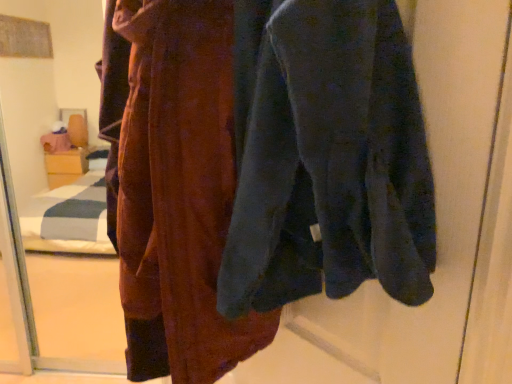
At what (x,y) coordinates should I click in order to perform the action: click on velvet dark blue sweatshirt at center. Please return your answer as a coordinate pair (x, y). Looking at the image, I should click on (326, 157).

Measure the distance between point (415,290) and camera.

Point (415,290) is 19.02 inches from camera.

What do you see at coordinates (326, 157) in the screenshot? I see `velvet dark blue sweatshirt at center` at bounding box center [326, 157].

Identify the location of velvet maroon robe at center. The height and width of the screenshot is (384, 512). (173, 185).

Describe the element at coordinates (173, 185) in the screenshot. I see `velvet maroon robe at center` at that location.

Identify the location of velvet dark blue sweatshirt at center. Image resolution: width=512 pixels, height=384 pixels. (326, 157).

Can you confirm if velvet dark blue sweatshirt at center is positioned to the right of velvet maroon robe at center?

Yes.

In the scene shown: Does velvet dark blue sweatshirt at center lie behind velvet maroon robe at center?

No, velvet dark blue sweatshirt at center is closer to the viewer.

Is point (394, 23) farther from camera compared to point (149, 233)?

No, it is not.

From the image's perspective, which one is positioned higher, velvet dark blue sweatshirt at center or velvet maroon robe at center?

velvet dark blue sweatshirt at center appears higher in the image.

From a real-world perspective, is velvet dark blue sweatshirt at center above or below velvet maroon robe at center?

velvet dark blue sweatshirt at center is situated higher than velvet maroon robe at center in the real world.

In terms of width, does velvet dark blue sweatshirt at center look wider or thinner when compared to velvet maroon robe at center?

Clearly, velvet dark blue sweatshirt at center has less width compared to velvet maroon robe at center.

Considering the relative sizes of velvet dark blue sweatshirt at center and velvet maroon robe at center in the image provided, is velvet dark blue sweatshirt at center taller than velvet maroon robe at center?

No, velvet dark blue sweatshirt at center is not taller than velvet maroon robe at center.

Is velvet dark blue sweatshirt at center bigger or smaller than velvet maroon robe at center?

In the image, velvet dark blue sweatshirt at center appears to be smaller than velvet maroon robe at center.

Is velvet dark blue sweatshirt at center completely or partially outside of velvet maroon robe at center?

Absolutely, velvet dark blue sweatshirt at center is external to velvet maroon robe at center.

Is there a large distance between velvet dark blue sweatshirt at center and velvet maroon robe at center?

Actually, velvet dark blue sweatshirt at center and velvet maroon robe at center are a little close together.

Is velvet dark blue sweatshirt at center positioned with its back to velvet maroon robe at center?

No, velvet dark blue sweatshirt at center is not facing away from velvet maroon robe at center.

Locate an element on the screen. Image resolution: width=512 pixels, height=384 pixels. fancy dress behind the velvet dark blue sweatshirt at center is located at coordinates (173, 185).

Does velvet maroon robe at center appear on the left side of velvet dark blue sweatshirt at center?

Correct, you'll find velvet maroon robe at center to the left of velvet dark blue sweatshirt at center.

Is velvet maroon robe at center in front of or behind velvet dark blue sweatshirt at center in the image?

velvet maroon robe at center is behind velvet dark blue sweatshirt at center.

Does point (209, 266) appear closer or farther from the camera than point (276, 276)?

Point (209, 266) appears to be closer to the viewer than point (276, 276).

From the image's perspective, is velvet maroon robe at center on velvet dark blue sweatshirt at center?

No, from the image's perspective, velvet maroon robe at center is not on top of velvet dark blue sweatshirt at center.

From a real-world perspective, is velvet maroon robe at center physically located above or below velvet dark blue sweatshirt at center?

velvet maroon robe at center is situated lower than velvet dark blue sweatshirt at center in the real world.

Which of these two, velvet maroon robe at center or velvet dark blue sweatshirt at center, is wider?

Wider between the two is velvet maroon robe at center.

Does velvet maroon robe at center have a greater height compared to velvet dark blue sweatshirt at center?

Correct, velvet maroon robe at center is much taller as velvet dark blue sweatshirt at center.

Which of these two, velvet maroon robe at center or velvet dark blue sweatshirt at center, is bigger?

velvet maroon robe at center is bigger.

Is velvet maroon robe at center positioned beyond the bounds of velvet dark blue sweatshirt at center?

Yes, velvet maroon robe at center is outside of velvet dark blue sweatshirt at center.

Is velvet maroon robe at center not close to velvet dark blue sweatshirt at center?

No, velvet maroon robe at center is in close proximity to velvet dark blue sweatshirt at center.

In the scene shown: Is velvet maroon robe at center facing towards velvet dark blue sweatshirt at center?

No, velvet maroon robe at center is not turned towards velvet dark blue sweatshirt at center.

Can you tell me how much velvet maroon robe at center and velvet dark blue sweatshirt at center differ in facing direction?

The facing directions of velvet maroon robe at center and velvet dark blue sweatshirt at center are 0.00576 degrees apart.

Find the location of a particular element. The width and height of the screenshot is (512, 384). fancy dress below the velvet dark blue sweatshirt at center (from the image's perspective) is located at coordinates (173, 185).

This screenshot has width=512, height=384. What are the coordinates of `sweatshirt that appears above the velvet maroon robe at center (from a real-world perspective)` in the screenshot? It's located at pyautogui.click(x=326, y=157).

Identify the location of fancy dress directly beneath the velvet dark blue sweatshirt at center (from a real-world perspective). The width and height of the screenshot is (512, 384). (173, 185).